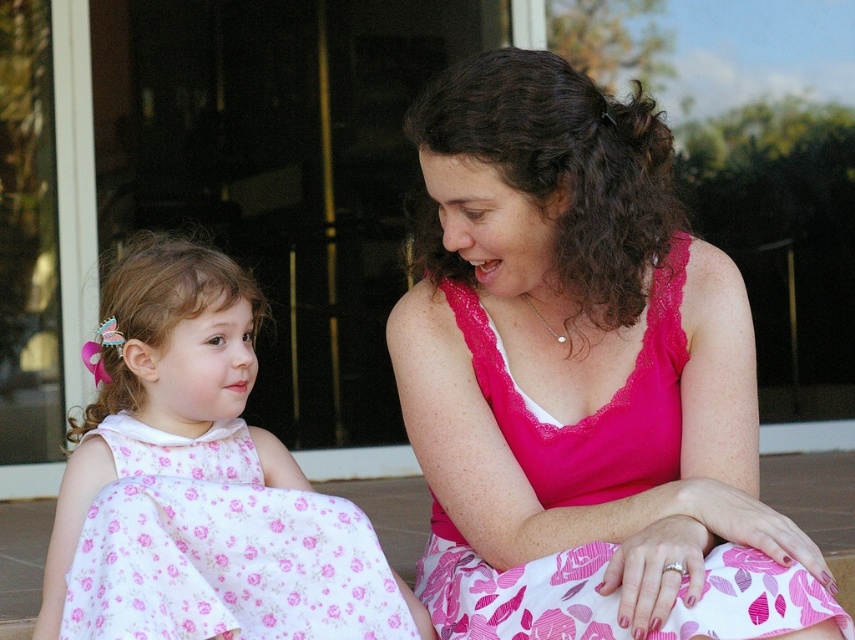
Is point (145, 385) positioned after point (588, 554)?

Yes, it is.

Does white floral dress at left have a lesser width compared to pink floral fabric dress at center?

No, white floral dress at left is not thinner than pink floral fabric dress at center.

Who is more distant from viewer, (x=223, y=477) or (x=581, y=429)?

The point (x=223, y=477) is behind.

Find the location of a particular element. white floral dress at left is located at coordinates (199, 477).